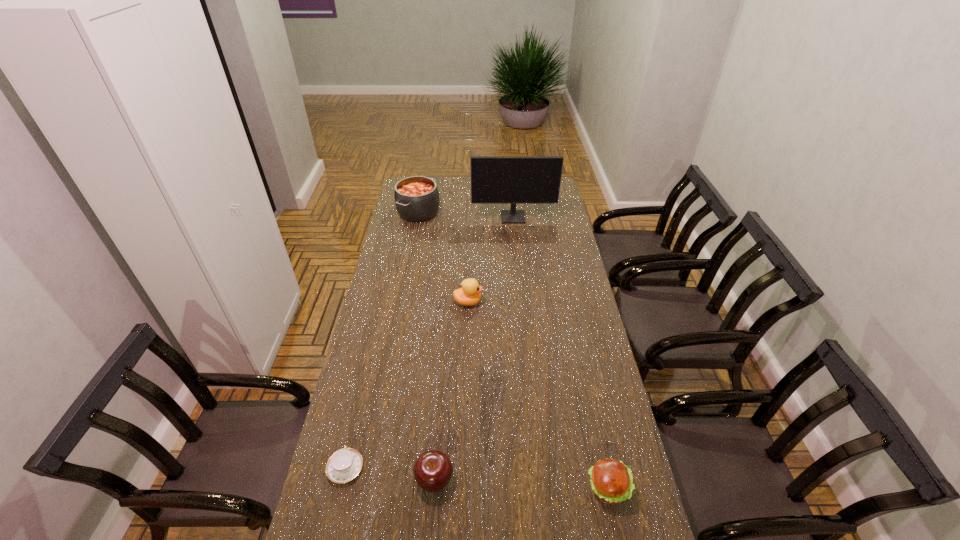
Locate an element on the screen. The width and height of the screenshot is (960, 540). vacant area situated on the back of the hamburger is located at coordinates (587, 390).

Image resolution: width=960 pixels, height=540 pixels. In order to click on vacant space located 0.130m on the side with the handle of the teacup in this screenshot , I will do `click(358, 413)`.

At what (x,y) coordinates should I click in order to perform the action: click on free spot located on the side with the handle of the teacup. Please return your answer as a coordinate pair (x, y). The height and width of the screenshot is (540, 960). Looking at the image, I should click on (365, 386).

The image size is (960, 540). Find the location of `vacant space located 0.300m on the side with the handle of the teacup`. vacant space located 0.300m on the side with the handle of the teacup is located at coordinates (369, 369).

What are the coordinates of `object at the far edge` in the screenshot? It's located at (416, 198).

Find the location of a particular element. casserole situated at the left edge is located at coordinates (416, 198).

Find the location of a particular element. This screenshot has width=960, height=540. teacup situated at the left edge is located at coordinates (345, 464).

Locate an element on the screen. This screenshot has width=960, height=540. computer monitor at the right edge is located at coordinates (513, 180).

Locate an element on the screen. The image size is (960, 540). hamburger at the right edge is located at coordinates (611, 481).

I want to click on object that is at the far left corner, so click(x=416, y=198).